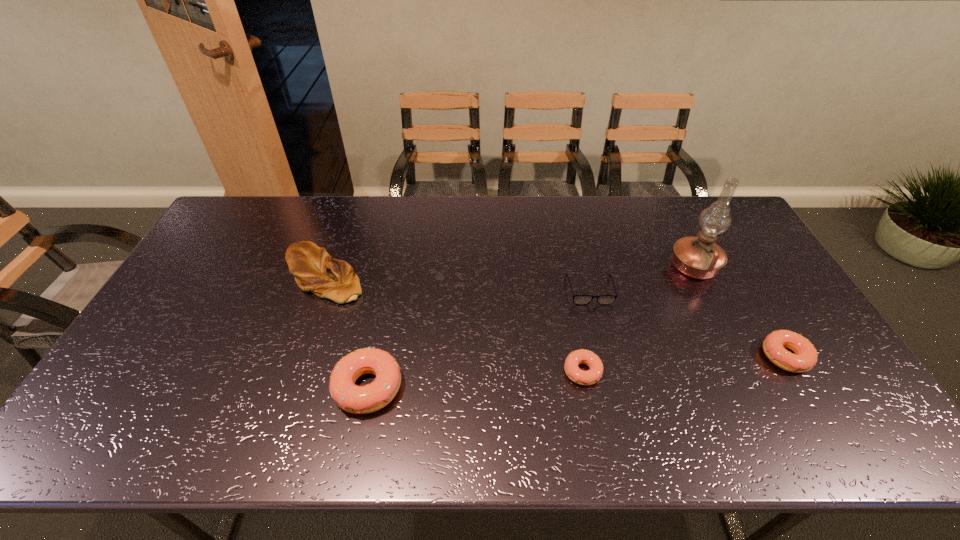
You are a GUI agent. You are given a task and a screenshot of the screen. Output one action in this format:
    pyautogui.click(x=<x>, y=<y>)
    Task: Click on the doughnut that is the second closest one to the second doughnut from right to left
    The image size is (960, 540).
    Given the screenshot: What is the action you would take?
    pyautogui.click(x=805, y=357)

Find the location of a particular element. doughnut that is the second closest to the bread is located at coordinates (574, 373).